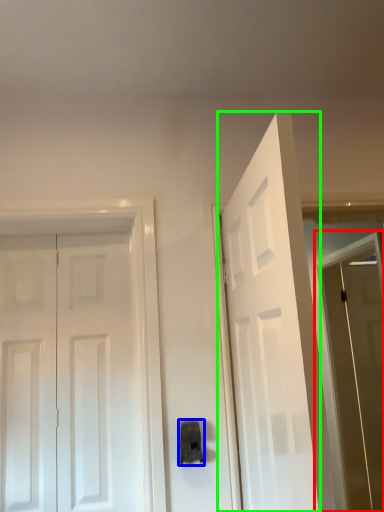
Question: Which object is positioned closest to screen door (highlighted by a red box)? Select from door handle (highlighted by a blue box) and door (highlighted by a green box).

Choices:
 (A) door handle
 (B) door

Answer: (B)